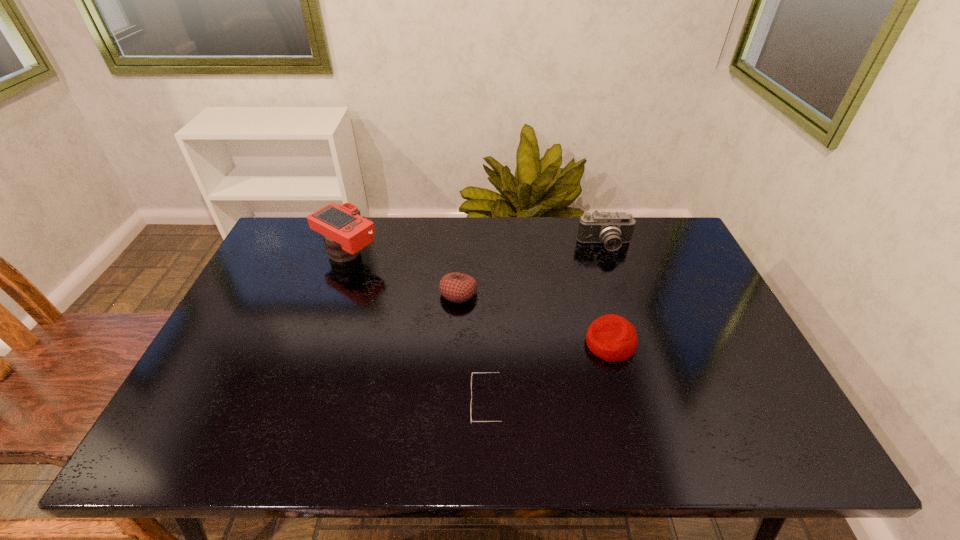
Where is `the leftmost object`? This screenshot has width=960, height=540. the leftmost object is located at coordinates 346,232.

Where is `the taller camera`? the taller camera is located at coordinates (346, 232).

The height and width of the screenshot is (540, 960). Identify the location of the second tallest object. (612, 229).

In order to click on the shorter camera in this screenshot , I will do `click(612, 229)`.

Find the location of `the fourth farthest object`. the fourth farthest object is located at coordinates (612, 338).

Locate an element on the screen. The height and width of the screenshot is (540, 960). the nearer beanbag is located at coordinates pyautogui.click(x=612, y=338).

This screenshot has width=960, height=540. Find the location of `the left beanbag`. the left beanbag is located at coordinates (456, 287).

I want to click on the farther beanbag, so coord(456,287).

This screenshot has width=960, height=540. In order to click on the nearest object in this screenshot , I will do `click(500, 372)`.

Image resolution: width=960 pixels, height=540 pixels. What are the coordinates of `the shortest object` in the screenshot? It's located at (500, 372).